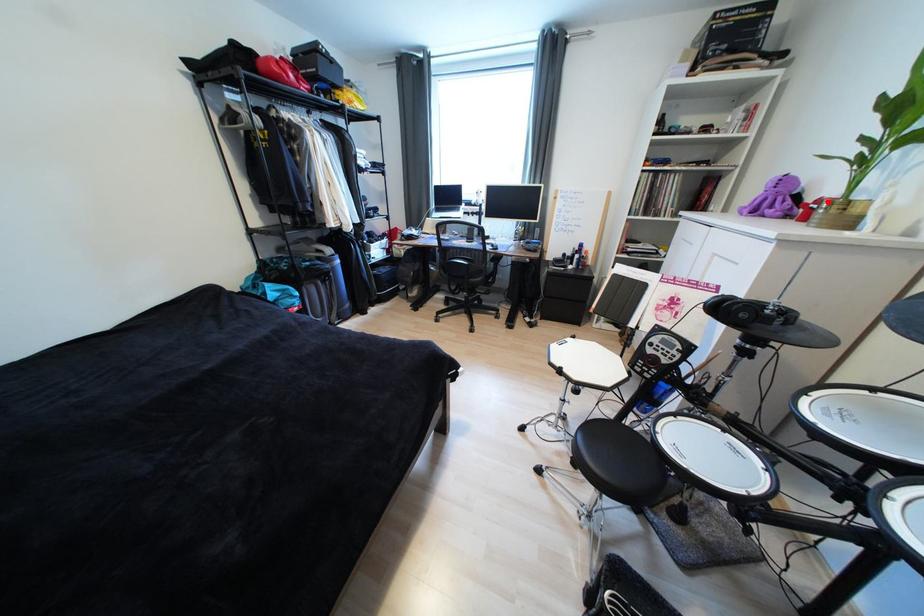
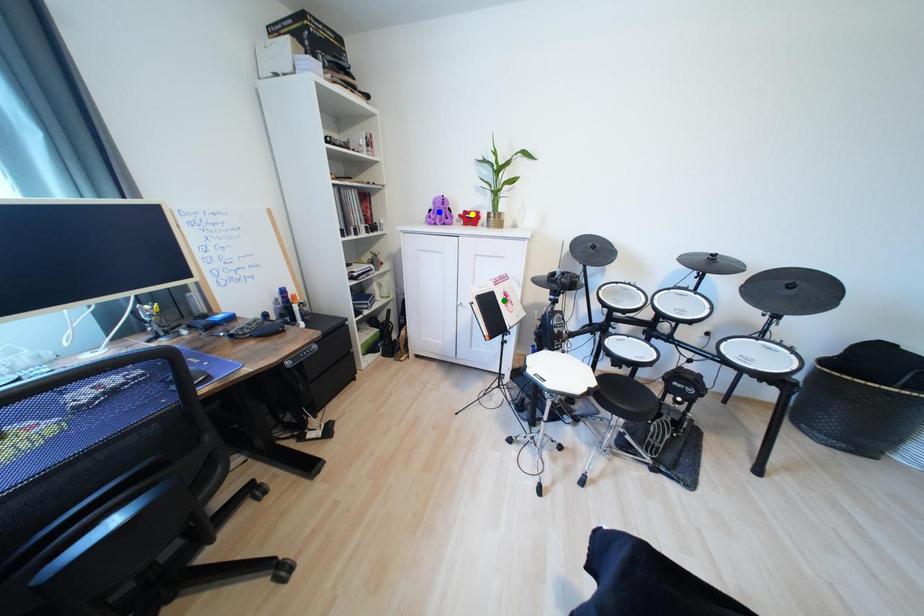
Question: I am providing you with two images of the same scene from different viewpoints. A red point is marked on the first image. You are given multiple points on the second image. Which point in image 2 represents the same 3d spot as the red point in image 1?

Choices:
 (A) yellow point
 (B) green point
 (C) blue point

Answer: (A)